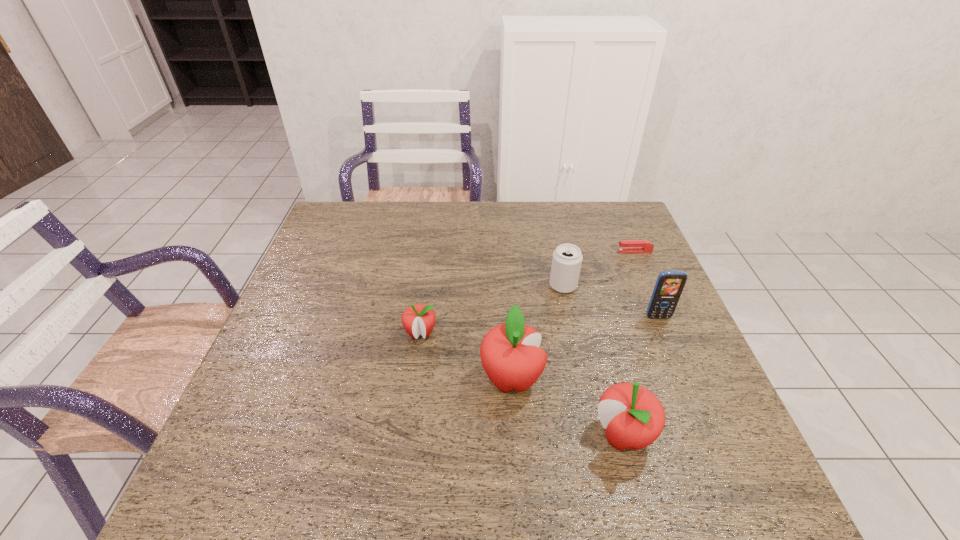
Locate an element on the screen. This screenshot has height=540, width=960. the fourth farthest object is located at coordinates (418, 319).

Where is `the leftmost apple`? This screenshot has width=960, height=540. the leftmost apple is located at coordinates (418, 319).

The image size is (960, 540). I want to click on the fifth farthest object, so 510,354.

Locate an element on the screen. The width and height of the screenshot is (960, 540). the second farthest apple is located at coordinates (510, 354).

Identify the location of the nearest apple. (633, 417).

Image resolution: width=960 pixels, height=540 pixels. In order to click on the second tallest apple in this screenshot , I will do `click(633, 417)`.

Locate an element on the screen. the fifth nearest object is located at coordinates (x=567, y=258).

The width and height of the screenshot is (960, 540). Find the location of `can`. can is located at coordinates (567, 258).

Find the location of a particular element. The image size is (960, 540). stapler is located at coordinates (626, 246).

Identify the location of the shortest object. This screenshot has width=960, height=540. (626, 246).